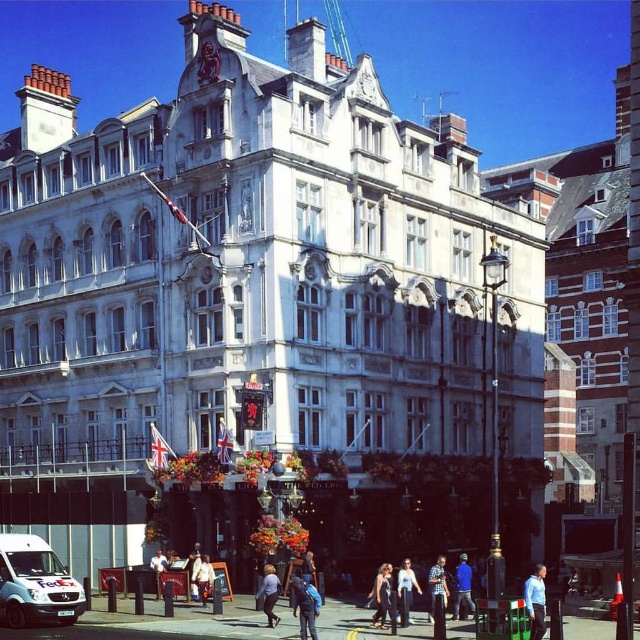
Question: Does light blue shirt at center have a larger size compared to light blue jeans at center?

Choices:
 (A) no
 (B) yes

Answer: (B)

Question: Can you confirm if blue backpack at center is positioned to the right of light blue denim jacket at lower center?

Choices:
 (A) yes
 (B) no

Answer: (A)

Question: Which object is farther from the camera taking this photo?

Choices:
 (A) blue fabric jacket at center
 (B) light blue jeans at center
 (C) light beige jacket at center

Answer: (C)

Question: Does blue fabric jacket at center have a greater width compared to light blue denim jacket at lower center?

Choices:
 (A) yes
 (B) no

Answer: (A)

Question: Considering the real-world distances, which object is closest to the white matte fedex van at lower left?

Choices:
 (A) light beige jacket at center
 (B) blue backpack at center

Answer: (A)

Question: Which of these objects is positioned farthest from the light beige jacket at center?

Choices:
 (A) blue denim jeans at center
 (B) blue shirt at center
 (C) white matte fedex van at lower left

Answer: (B)